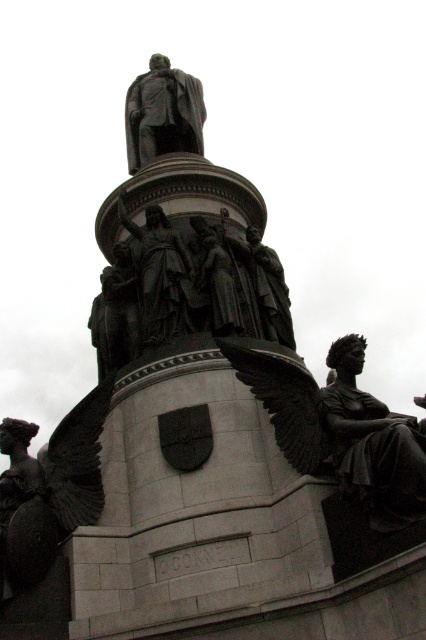
You are standing at the base of the monument and want to take a photo of the point labeled as point (391, 422). The camera you are using has a maximum focus range of 120 feet. Will you be able to focus on that point?

The point (391, 422) is 131.07 feet from the camera, which exceeds the camera maximum focus range of 120 feet. Therefore, you won not be able to focus on that point.

You are a tour guide explaining the monument to visitors. Pointing to the polished bronze statue at right and the bronze statue at center, you want to describe their spatial relationship. Which statue is located below the other?

The polished bronze statue at right is positioned under the bronze statue at center, meaning the bronze statue at center is above it.